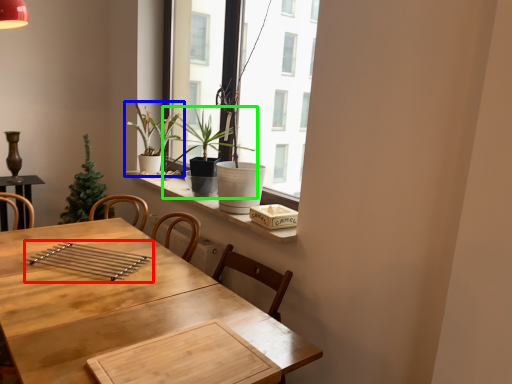
Question: Based on their relative distances, which object is nearer to silverware (highlighted by a red box)? Choose from houseplant (highlighted by a blue box) and houseplant (highlighted by a green box).

Choices:
 (A) houseplant
 (B) houseplant

Answer: (B)